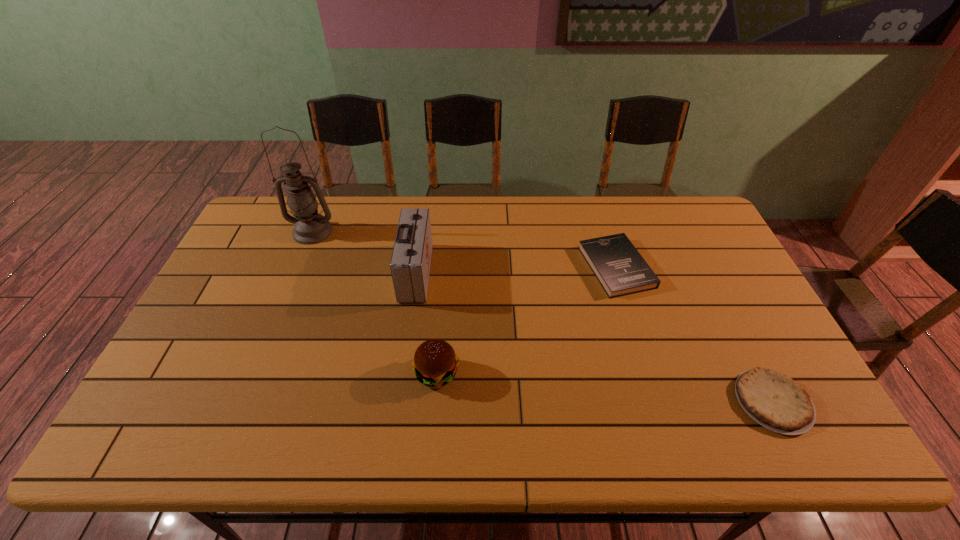
Image resolution: width=960 pixels, height=540 pixels. In the image, there is a desktop. Identify the location of free region at the near edge. [339, 416].

Where is `vacant space at the left edge of the desktop`? vacant space at the left edge of the desktop is located at coordinates (245, 313).

You are a GUI agent. You are given a task and a screenshot of the screen. Output one action in this format:
    pyautogui.click(x=<x>, y=<y>)
    Task: Click on the free point at the right edge
    
    Given the screenshot: What is the action you would take?
    pyautogui.click(x=732, y=313)

At what (x,y) coordinates should I click in order to perform the action: click on vacant area at the far left corner of the desktop. Please return your answer as a coordinate pair (x, y). Looking at the image, I should click on (259, 220).

Locate an element on the screen. This screenshot has height=540, width=960. free location at the near left corner is located at coordinates (183, 434).

At what (x,y) coordinates should I click in order to perform the action: click on blank region between the fourth shortest object and the shortest object. Please return your answer as a coordinate pair (x, y). Looking at the image, I should click on (594, 337).

Locate an element on the screen. The image size is (960, 540). free point between the leftmost object and the second shortest object is located at coordinates (465, 249).

I want to click on blank region between the book and the tallest object, so click(465, 249).

At what (x,y) coordinates should I click in order to perform the action: click on free space between the rightmost object and the second tallest object. Please return your answer as a coordinate pair (x, y). This screenshot has height=540, width=960. Looking at the image, I should click on pyautogui.click(x=594, y=337).

Where is `vacant region between the second tallest object and the leftmost object`? vacant region between the second tallest object and the leftmost object is located at coordinates (365, 252).